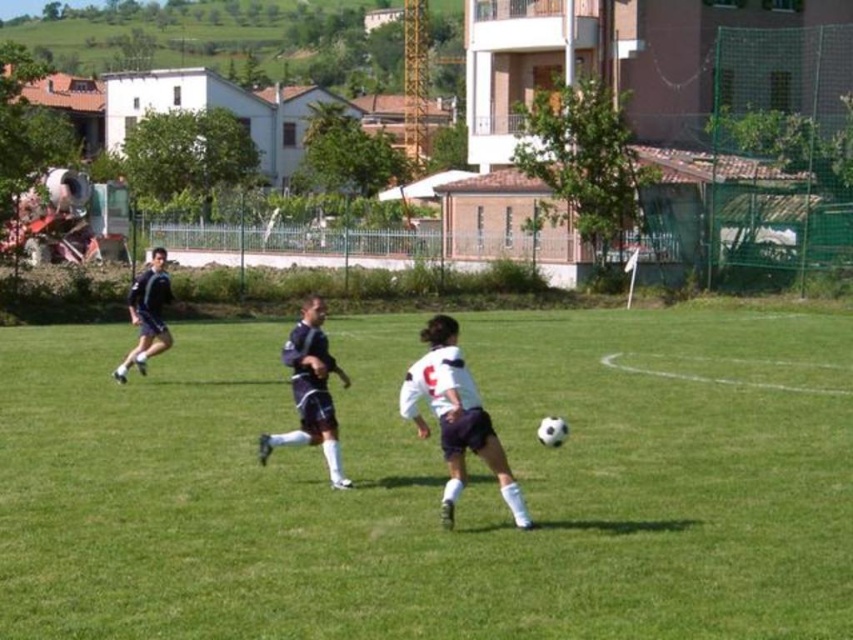
Question: Does white matte jersey at center have a smaller size compared to dark blue jersey at left?

Choices:
 (A) yes
 (B) no

Answer: (A)

Question: Which is farther from the dark blue jersey at left?

Choices:
 (A) white matte jersey at center
 (B) green grass at center

Answer: (A)

Question: Which object is closer to the camera taking this photo?

Choices:
 (A) dark blue jersey at left
 (B) white matte jersey at center
 (C) dark blue jersey at center
 (D) green grass at center

Answer: (D)

Question: Does white matte jersey at center lie in front of dark blue jersey at left?

Choices:
 (A) yes
 (B) no

Answer: (A)

Question: Is white matte jersey at center positioned before dark blue jersey at left?

Choices:
 (A) yes
 (B) no

Answer: (A)

Question: Which object is closer to the camera taking this photo?

Choices:
 (A) dark blue jersey at center
 (B) dark blue jersey at left
 (C) green grass at center
 (D) white matte jersey at center

Answer: (C)